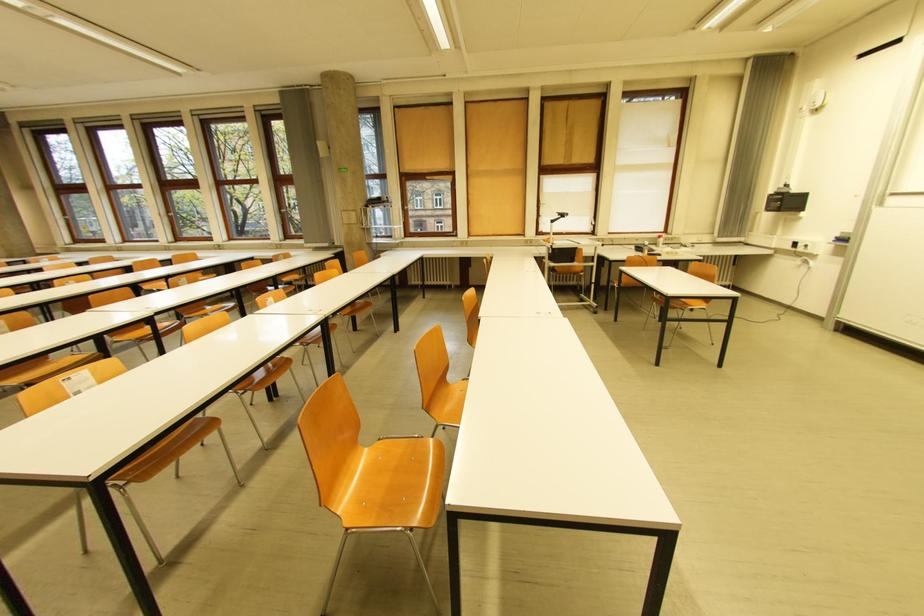
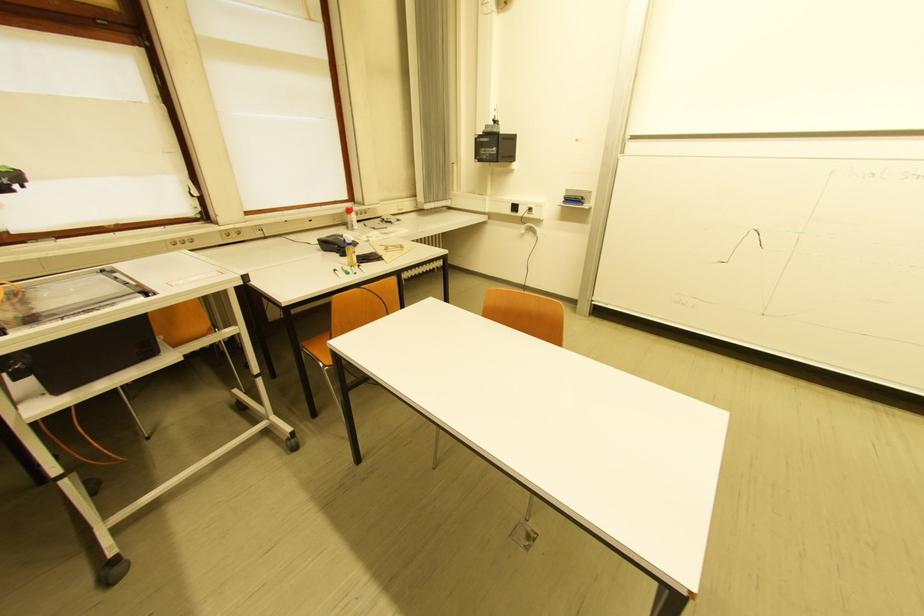
Locate, in the second image, the point that corresponds to [662,245] in the first image.

(351, 225)